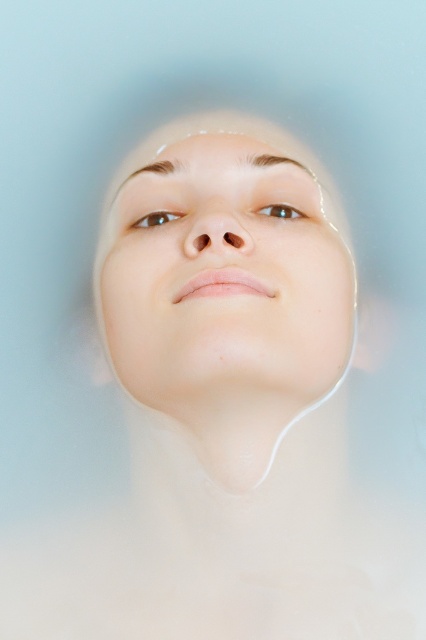
Looking at the serene underwater portrait, you notice the smooth skin face at center and the brown matte eye at upper center. Which of these two elements takes up more visual space in the image?

The smooth skin face at center takes up more visual space compared to the brown matte eye at upper center because it is larger in size.

In the scene shown: You are a photographer analyzing the composition of this underwater portrait. You notice the smooth skin face at center and the brown glossy eye at center. Based on their positions, which object is closer to the camera?

The smooth skin face at center is positioned under the brown glossy eye at center, meaning the eye is closer to the camera since it appears above the face.

You are an artist analyzing the composition of this underwater portrait. You notice the brown matte eye at upper center and the brown glossy eye at center. Which eye appears closer to the surface of the water?

The brown glossy eye at center is behind the brown matte eye at upper center, so the brown matte eye at upper center is closer to the surface of the water.